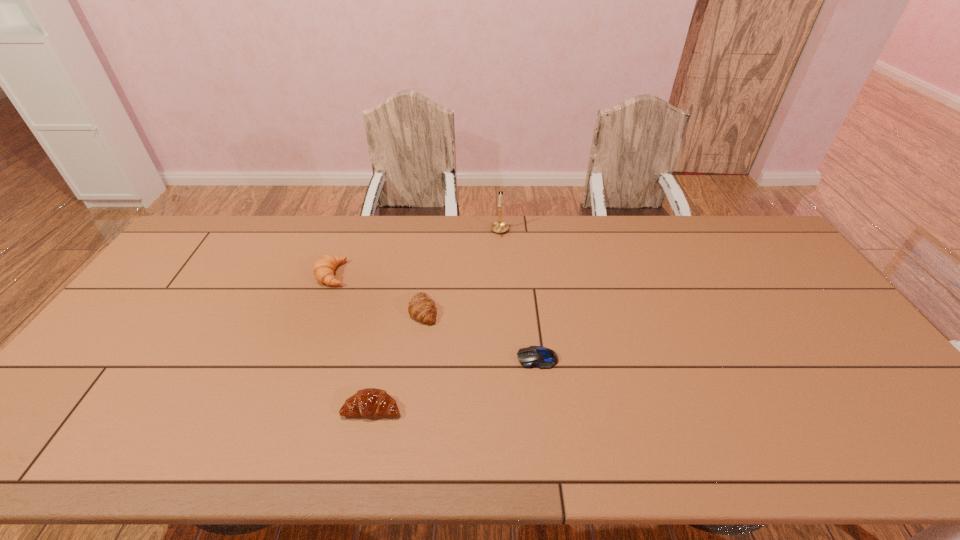
In the image, there is a desktop. At what (x,y) coordinates should I click in order to perform the action: click on free region at the far right corner. Please return your answer as a coordinate pair (x, y). Looking at the image, I should click on (748, 235).

This screenshot has width=960, height=540. In the image, there is a desktop. What are the coordinates of `free region at the near right corner` in the screenshot? It's located at (867, 434).

Identify the location of vacant point located between the farthest crescent roll and the candle holder. The width and height of the screenshot is (960, 540). (416, 253).

Image resolution: width=960 pixels, height=540 pixels. I want to click on blank region between the nearest crescent roll and the second farthest crescent roll, so click(x=397, y=359).

At what (x,y) coordinates should I click in order to perform the action: click on free space between the third farthest object and the nearest crescent roll. Please return your answer as a coordinate pair (x, y). The image size is (960, 540). Looking at the image, I should click on (397, 359).

The height and width of the screenshot is (540, 960). In order to click on unoccupied area between the computer mouse and the third nearest object in this screenshot , I will do [x=480, y=334].

This screenshot has height=540, width=960. What are the coordinates of `vacant area between the farthest crescent roll and the candle holder` in the screenshot? It's located at (416, 253).

This screenshot has width=960, height=540. I want to click on vacant area between the computer mouse and the nearest crescent roll, so click(x=455, y=383).

Image resolution: width=960 pixels, height=540 pixels. In order to click on unoccupied area between the nearest object and the shortest object in this screenshot , I will do `click(455, 383)`.

Find the location of a particular element. The width and height of the screenshot is (960, 540). the second closest object to the second farthest crescent roll is located at coordinates (371, 402).